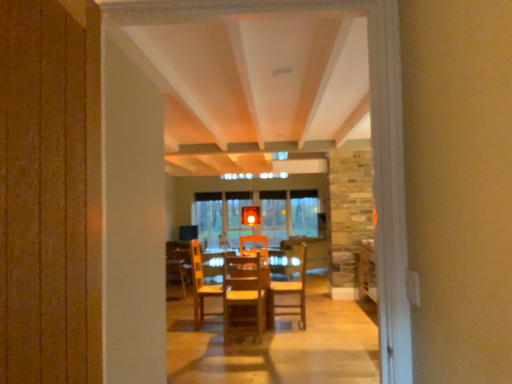
Question: From a real-world perspective, is wooden chair at center, which ranks as the 2th chair in back-to-front order, over wooden chair at center, the first chair positioned from the back?

Choices:
 (A) no
 (B) yes

Answer: (B)

Question: Can you confirm if wooden chair at center, which appears as the first chair when viewed from the left, is thinner than wooden chair at center, the first chair positioned from the back?

Choices:
 (A) no
 (B) yes

Answer: (B)

Question: From the image's perspective, is wooden chair at center, which is counted as the first chair, starting from the front, below wooden chair at center, the 2th chair positioned from the front?

Choices:
 (A) yes
 (B) no

Answer: (B)

Question: Is wooden chair at center, which appears as the first chair when viewed from the left, further to the viewer compared to wooden chair at center, the second chair from the left?

Choices:
 (A) no
 (B) yes

Answer: (A)

Question: From a real-world perspective, is wooden chair at center, which appears as the first chair when viewed from the left, physically below wooden chair at center, the second chair from the left?

Choices:
 (A) yes
 (B) no

Answer: (B)

Question: Does wooden chair at center, which appears as the first chair when viewed from the left, have a smaller size compared to wooden chair at center, the first chair positioned from the back?

Choices:
 (A) no
 (B) yes

Answer: (A)

Question: Is wooden chair at center, which is counted as the first chair, starting from the front, looking in the opposite direction of wooden table at center?

Choices:
 (A) no
 (B) yes

Answer: (B)

Question: Considering the relative positions of wooden chair at center, the 2th chair positioned from the right, and wooden table at center in the image provided, is wooden chair at center, the 2th chair positioned from the right, to the left of wooden table at center from the viewer's perspective?

Choices:
 (A) yes
 (B) no

Answer: (A)

Question: From a real-world perspective, is wooden chair at center, which is counted as the first chair, starting from the front, physically above wooden table at center?

Choices:
 (A) no
 (B) yes

Answer: (B)

Question: Is wooden chair at center, the 2th chair positioned from the right, taller than wooden table at center?

Choices:
 (A) yes
 (B) no

Answer: (A)

Question: Is wooden table at center surrounded by wooden chair at center, which is counted as the first chair, starting from the front?

Choices:
 (A) yes
 (B) no

Answer: (B)

Question: From a real-world perspective, is wooden chair at center, which appears as the first chair when viewed from the left, located beneath wooden table at center?

Choices:
 (A) yes
 (B) no

Answer: (B)

Question: Is wooden table at center oriented towards wooden chairs at center?

Choices:
 (A) no
 (B) yes

Answer: (B)